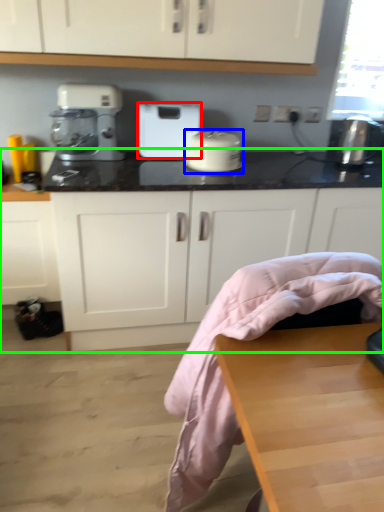
Question: Considering the real-world distances, which object is closest to home appliance (highlighted by a red box)? kitchen appliance (highlighted by a blue box) or countertop (highlighted by a green box).

Choices:
 (A) kitchen appliance
 (B) countertop

Answer: (A)